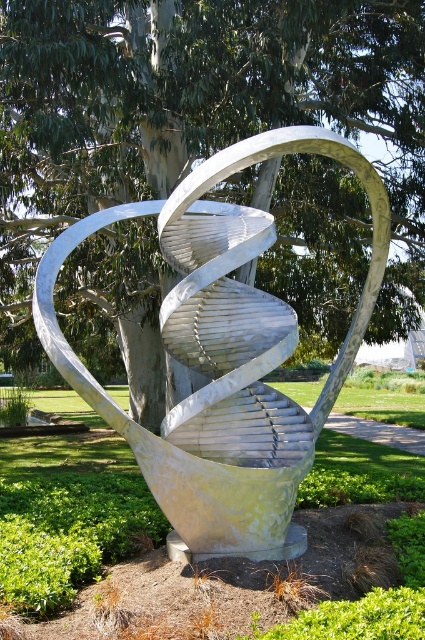
You are standing in the park and see the green leafy tree at center and the metallic silver sculpture at center. Which object is located to the left of the other?

The green leafy tree at center is positioned on the left side of metallic silver sculpture at center.

You are an artist planning to create a miniature model of the sculpture and the surrounding area. You need to ensure that the proportions between the green leafy tree at center and the silver metallic spiral at center are accurate. Which object should you make larger in your model?

The green leafy tree at center should be made larger in the model since it is larger in size than the silver metallic spiral at center according to the description.